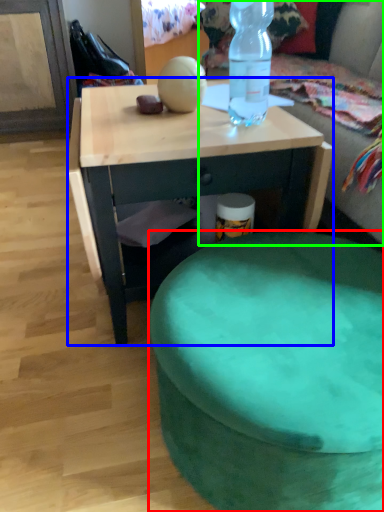
Question: Which is farther away from stool (highlighted by a red box)? desk (highlighted by a blue box) or bean bag chair (highlighted by a green box)?

Choices:
 (A) desk
 (B) bean bag chair

Answer: (B)